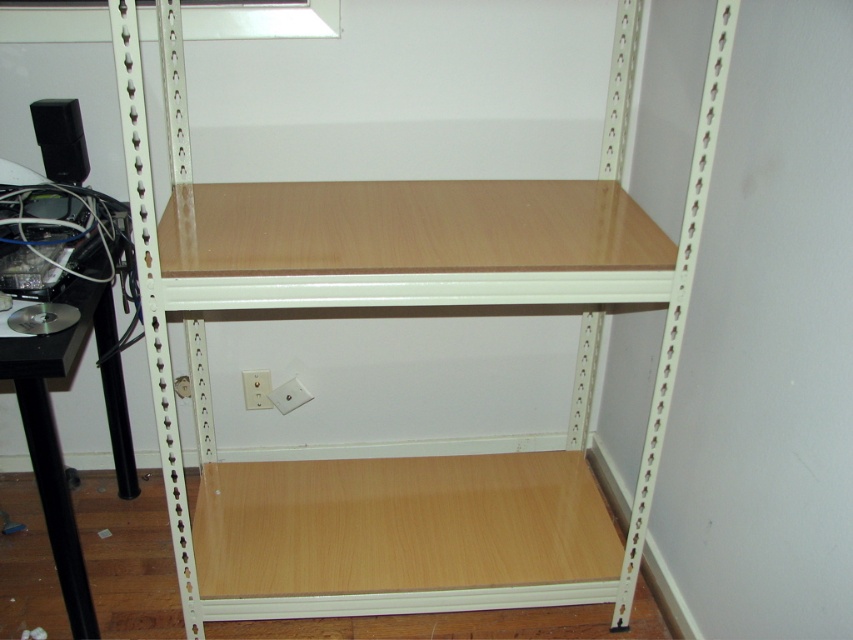
You are standing at point A located at point [15,289]. You want to walk to point B, which is 4.02 feet away from you. Can you reach point B within 3 steps if each of your steps is 1.5 feet long?

Since each step is 1.5 feet and you need to cover 4.02 feet, 3 steps would cover 4.5 feet, which is more than enough. Yes, you can reach point B within 3 steps.

Based on the photo, you are organizing cables in the image. You need to route a cable from the black matte speaker at upper left to the black plastic computer desk at left. Is the cable long enough if it is 1 meter long?

The black plastic computer desk at left is below the black matte speaker at upper left. The vertical distance between them requires the cable to be at least 1 meter long, so a 1 meter cable should suffice if there are no obstructions.

You are setting up a new computer workstation and need to plug in your computer. The black plastic computer desk at left has your computer, and the white plastic electric outlet at lower center is where you need to plug it in. Can you easily reach the outlet from the desk without moving either?

The black plastic computer desk at left is to the left of the white plastic electric outlet at lower center, so the distance between them may be manageable. However, whether you can easily reach the outlet depends on the length of your cables. If the cables are long enough, you can plug them in without moving anything.